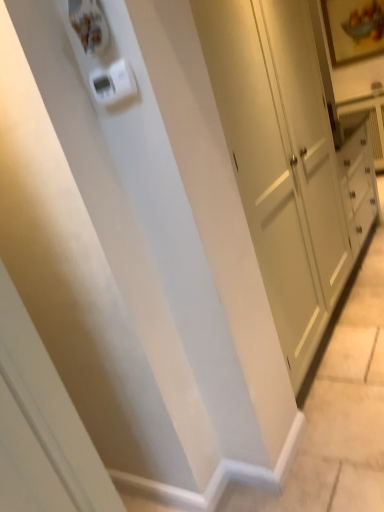
What do you see at coordinates (50, 407) in the screenshot? I see `white glossy screen door at lower left` at bounding box center [50, 407].

Locate an element on the screen. white glossy screen door at lower left is located at coordinates (50, 407).

Locate an element on the screen. white plastic light switch at upper center is located at coordinates (113, 83).

The image size is (384, 512). What do you see at coordinates (113, 83) in the screenshot?
I see `white plastic light switch at upper center` at bounding box center [113, 83].

The image size is (384, 512). Find the location of `white glossy screen door at lower left`. white glossy screen door at lower left is located at coordinates click(50, 407).

Between white plastic light switch at upper center and white glossy screen door at lower left, which one appears on the right side from the viewer's perspective?

white plastic light switch at upper center is more to the right.

Does white plastic light switch at upper center lie in front of white glossy screen door at lower left?

No, the depth of white plastic light switch at upper center is greater than that of white glossy screen door at lower left.

Is point (114, 67) in front of point (32, 326)?

Yes, point (114, 67) is in front of point (32, 326).

Consider the image. From the image's perspective, between white plastic light switch at upper center and white glossy screen door at lower left, which one is located above?

white plastic light switch at upper center, from the image's perspective.

From a real-world perspective, is white plastic light switch at upper center physically located above or below white glossy screen door at lower left?

From a real-world perspective, white plastic light switch at upper center is physically above white glossy screen door at lower left.

Considering the relative sizes of white plastic light switch at upper center and white glossy screen door at lower left in the image provided, is white plastic light switch at upper center wider than white glossy screen door at lower left?

In fact, white plastic light switch at upper center might be narrower than white glossy screen door at lower left.

Looking at this image, considering the sizes of white plastic light switch at upper center and white glossy screen door at lower left in the image, is white plastic light switch at upper center taller or shorter than white glossy screen door at lower left?

white plastic light switch at upper center is shorter than white glossy screen door at lower left.

Which of these two, white plastic light switch at upper center or white glossy screen door at lower left, is bigger?

white glossy screen door at lower left.

Is white glossy screen door at lower left inside white plastic light switch at upper center?

No, white glossy screen door at lower left is not inside white plastic light switch at upper center.

Is white plastic light switch at upper center touching white glossy screen door at lower left?

No, white plastic light switch at upper center is not beside white glossy screen door at lower left.

Is white plastic light switch at upper center turned away from white glossy screen door at lower left?

No, white glossy screen door at lower left is not at the back of white plastic light switch at upper center.

What's the angular difference between white plastic light switch at upper center and white glossy screen door at lower left's facing directions?

white plastic light switch at upper center and white glossy screen door at lower left are facing 90 degrees away from each other.

Locate an element on the screen. The width and height of the screenshot is (384, 512). screen door below the white plastic light switch at upper center (from the image's perspective) is located at coordinates (50, 407).

Does white glossy screen door at lower left appear on the left side of white plastic light switch at upper center?

Correct, you'll find white glossy screen door at lower left to the left of white plastic light switch at upper center.

Is white glossy screen door at lower left closer to camera compared to white plastic light switch at upper center?

Yes, it is in front of white plastic light switch at upper center.

Is point (18, 398) in front of point (95, 78)?

Yes, it is.

From the image's perspective, which one is positioned lower, white glossy screen door at lower left or white plastic light switch at upper center?

white glossy screen door at lower left is shown below in the image.

From a real-world perspective, which is physically below, white glossy screen door at lower left or white plastic light switch at upper center?

white glossy screen door at lower left is physically lower.

Consider the image. Is white glossy screen door at lower left wider than white plastic light switch at upper center?

Yes, white glossy screen door at lower left is wider than white plastic light switch at upper center.

Considering the sizes of objects white glossy screen door at lower left and white plastic light switch at upper center in the image provided, who is taller, white glossy screen door at lower left or white plastic light switch at upper center?

white glossy screen door at lower left is taller.

Who is smaller, white glossy screen door at lower left or white plastic light switch at upper center?

Smaller between the two is white plastic light switch at upper center.

Is white glossy screen door at lower left positioned beyond the bounds of white plastic light switch at upper center?

Yes, white glossy screen door at lower left is outside of white plastic light switch at upper center.

Is white glossy screen door at lower left placed right next to white plastic light switch at upper center?

No, white glossy screen door at lower left is not next to white plastic light switch at upper center.

Could you tell me if white glossy screen door at lower left is facing white plastic light switch at upper center?

No, white glossy screen door at lower left is not oriented towards white plastic light switch at upper center.

Where is `light switch located above the white glossy screen door at lower left (from the image's perspective)`? Image resolution: width=384 pixels, height=512 pixels. light switch located above the white glossy screen door at lower left (from the image's perspective) is located at coordinates (113, 83).

The width and height of the screenshot is (384, 512). In order to click on light switch above the white glossy screen door at lower left (from a real-world perspective) in this screenshot , I will do `click(113, 83)`.

Locate an element on the screen. Image resolution: width=384 pixels, height=512 pixels. light switch lying above the white glossy screen door at lower left (from the image's perspective) is located at coordinates click(x=113, y=83).